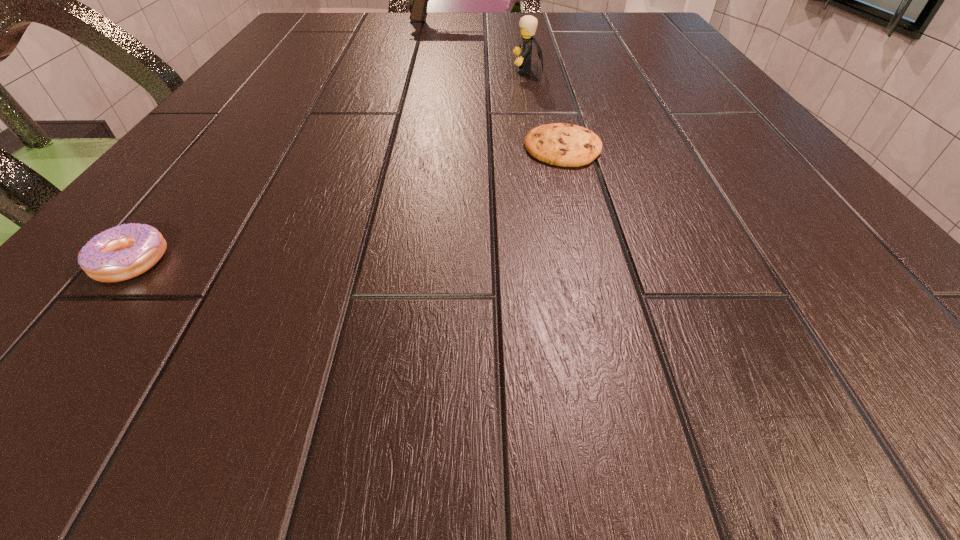
Identify the location of the third object from right to left. Image resolution: width=960 pixels, height=540 pixels. (420, 0).

This screenshot has width=960, height=540. In order to click on the farthest object in this screenshot , I will do `click(420, 0)`.

In order to click on Lego in this screenshot , I will do `click(528, 23)`.

Where is `the leftmost object`? Image resolution: width=960 pixels, height=540 pixels. the leftmost object is located at coordinates (123, 252).

The height and width of the screenshot is (540, 960). Find the location of `the third tallest object`. the third tallest object is located at coordinates (123, 252).

Find the location of a particular element. The image size is (960, 540). the second nearest object is located at coordinates (567, 145).

Locate an element on the screen. the shortest object is located at coordinates pyautogui.click(x=567, y=145).

At what (x,y) coordinates should I click in order to perform the action: click on vacant space located 0.130m at the muzzle of the pistol. Please return your answer as a coordinate pair (x, y). Looking at the image, I should click on (527, 21).

Identify the location of blank area located on the front-facing side of the third nearest object. (427, 70).

Where is `blank area located on the front-facing side of the third nearest object`? The height and width of the screenshot is (540, 960). blank area located on the front-facing side of the third nearest object is located at coordinates (463, 70).